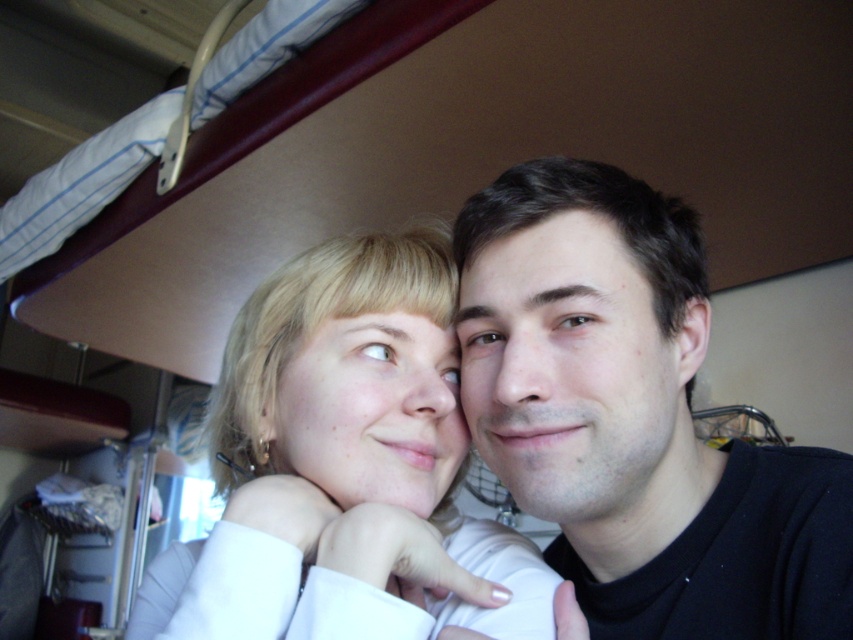
Can you confirm if smooth skin face at center is shorter than blonde hair at center?

In fact, smooth skin face at center may be taller than blonde hair at center.

Does smooth skin face at center appear over blonde hair at center?

Yes.

What do you see at coordinates (633, 417) in the screenshot? I see `smooth skin face at center` at bounding box center [633, 417].

Find the location of a particular element. This screenshot has height=640, width=853. smooth skin face at center is located at coordinates (633, 417).